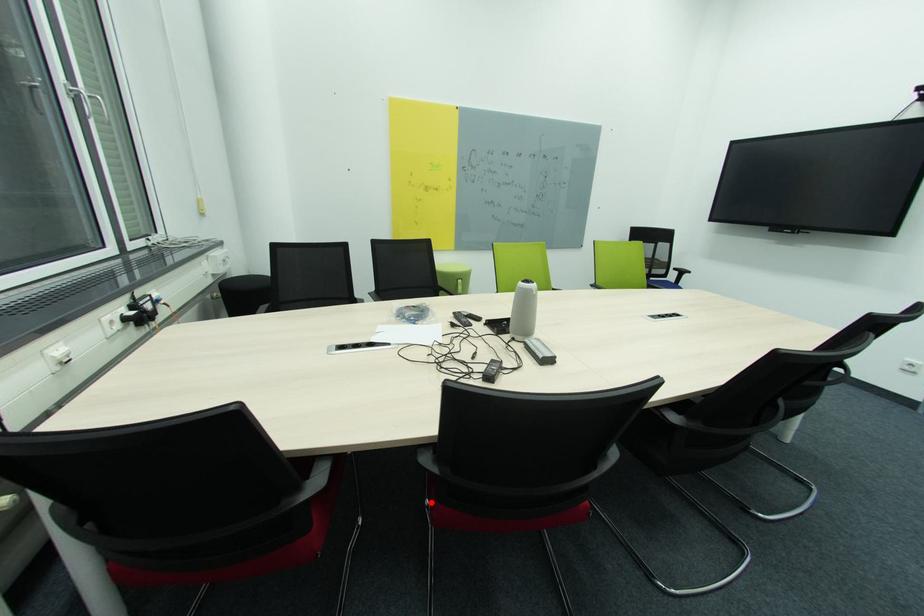
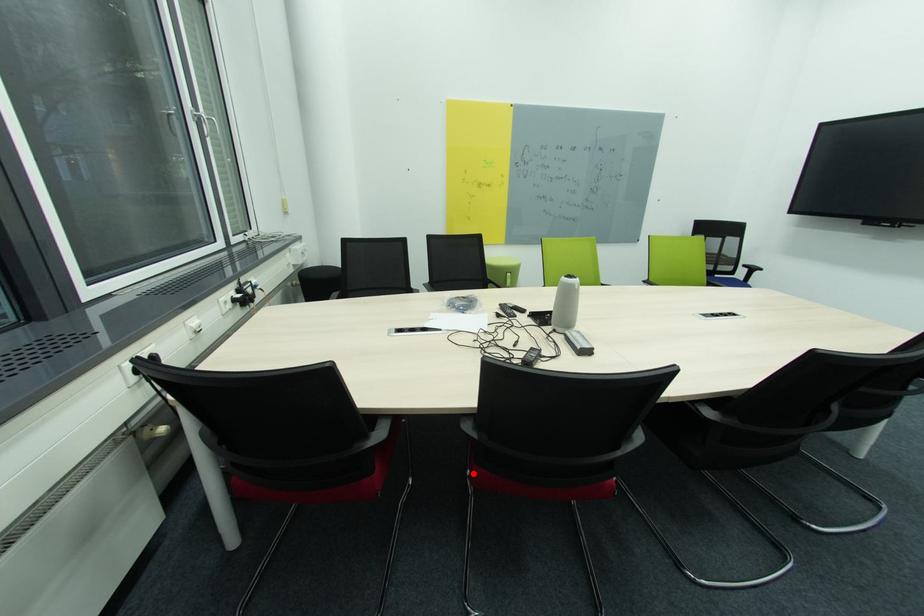
Based on the photo, I am providing you with two images of the same scene from different viewpoints. A red point is marked on the first image and another point is marked on the second image. Are the points marked in image1 and image2 representing the same 3D position?

Yes